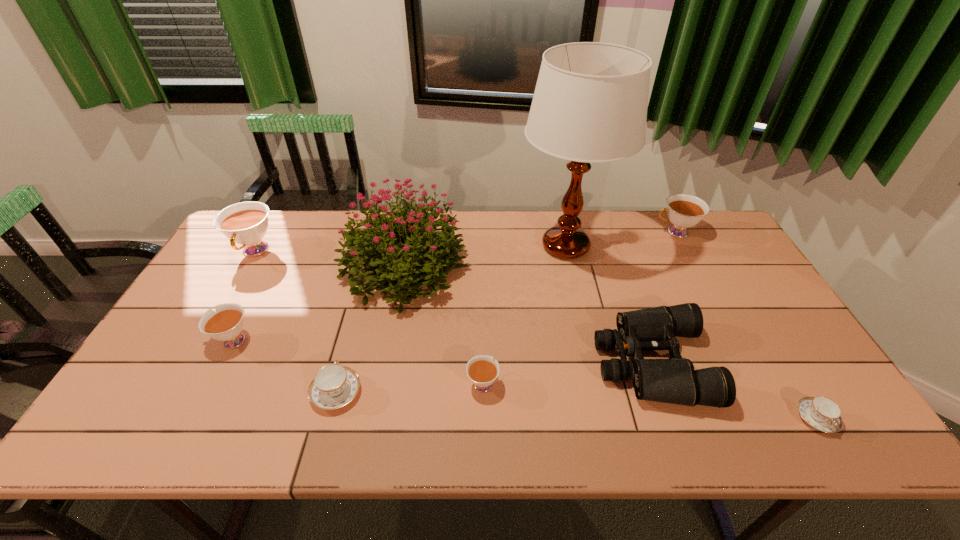
Find the location of a particular element. vacant space located on the side of the rightmost white teacup with the handle is located at coordinates (565, 232).

Find the location of a particular element. The width and height of the screenshot is (960, 540). blank space located on the side of the rightmost white teacup with the handle is located at coordinates (x=627, y=232).

I want to click on free space located 0.320m on the side of the rightmost white teacup with the handle, so click(x=560, y=232).

In order to click on vacant space situated through the eyepieces of the black binoculars in this screenshot , I will do `click(541, 363)`.

What are the coordinates of `vacant space located through the eyepieces of the black binoculars` in the screenshot? It's located at (541, 363).

You are a GUI agent. You are given a task and a screenshot of the screen. Output one action in this format:
    pyautogui.click(x=<x>, y=<y>)
    Task: Click on the free space located through the eyepieces of the black binoculars
    This screenshot has width=960, height=540.
    Given the screenshot: What is the action you would take?
    pyautogui.click(x=482, y=363)

Where is `blank space located on the side of the fourth shortest teacup with the handle`? The height and width of the screenshot is (540, 960). blank space located on the side of the fourth shortest teacup with the handle is located at coordinates (167, 341).

Image resolution: width=960 pixels, height=540 pixels. What are the coordinates of `free location located on the side of the fourth shortest teacup with the handle` in the screenshot? It's located at [179, 341].

Where is `vacant space located 0.150m on the side of the third white teacup from left to right with the handle`? vacant space located 0.150m on the side of the third white teacup from left to right with the handle is located at coordinates (483, 322).

Identify the location of vacant region located 0.330m on the side of the third white teacup from left to right with the handle. The image size is (960, 540). (482, 278).